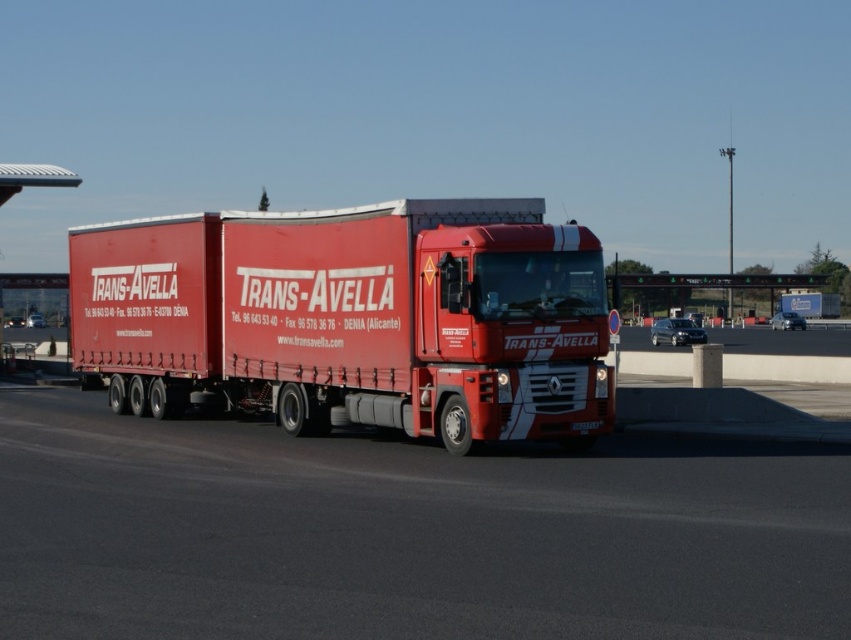
Question: Can you confirm if matte red trailer truck at center is positioned to the right of matte red truck at center?

Choices:
 (A) no
 (B) yes

Answer: (A)

Question: Does matte red trailer truck at center appear over matte red truck at center?

Choices:
 (A) no
 (B) yes

Answer: (A)

Question: Which of the following is the farthest from the observer?

Choices:
 (A) matte red truck at center
 (B) matte red trailer truck at center

Answer: (A)

Question: Does matte red trailer truck at center have a larger size compared to matte red truck at center?

Choices:
 (A) no
 (B) yes

Answer: (A)